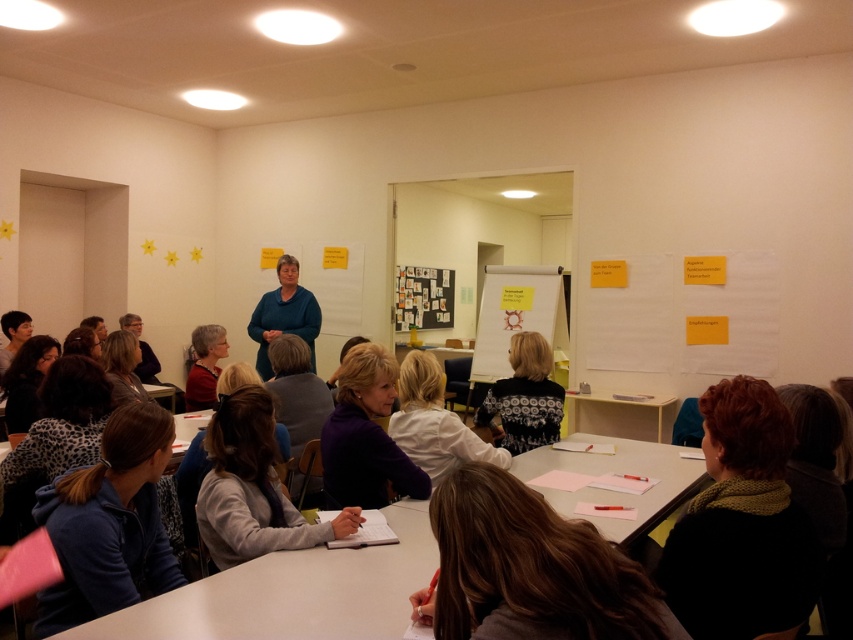
Question: Which object appears farthest from the camera in this image?

Choices:
 (A) matte black hair at lower left
 (B) dark brown hair at center
 (C) dark gray matte bulletin board at center
 (D) white matte table at center

Answer: (C)

Question: Which point is closer to the camera?

Choices:
 (A) leopard print hoodie at lower left
 (B) gray fabric jacket at lower center

Answer: (B)

Question: Does black knitted sweater at center have a larger size compared to teal smooth shirt at center?

Choices:
 (A) yes
 (B) no

Answer: (B)

Question: Which object appears farthest from the camera in this image?

Choices:
 (A) teal smooth shirt at center
 (B) matte black jacket at lower left

Answer: (A)

Question: Observing the image, what is the correct spatial positioning of gray fabric jacket at lower center in reference to purple matte shirt at center?

Choices:
 (A) below
 (B) above

Answer: (A)

Question: Is dark blue hoodie at lower left below matte black jacket at lower left?

Choices:
 (A) no
 (B) yes

Answer: (B)